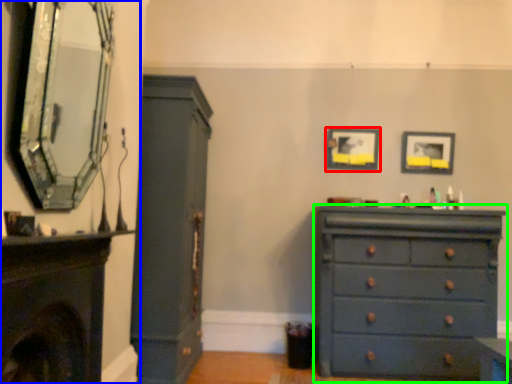
Question: Estimate the real-world distances between objects in this image. Which object is farther from picture frame (highlighted by a red box), fireplace (highlighted by a blue box) or chest of drawers (highlighted by a green box)?

Choices:
 (A) fireplace
 (B) chest of drawers

Answer: (A)